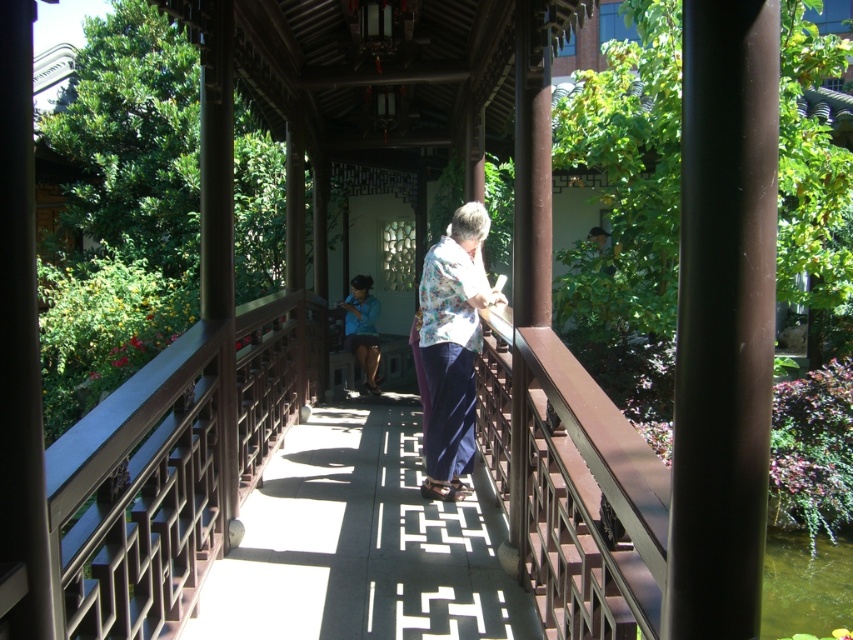
Is brown wooden bridge at center smaller than blue fabric shirt at center?

Correct, brown wooden bridge at center occupies less space than blue fabric shirt at center.

Which of these two, brown wooden bridge at center or blue fabric shirt at center, stands shorter?

Standing shorter between the two is brown wooden bridge at center.

Between point (621, 488) and point (364, 282), which one is positioned in front?

Point (621, 488) is more forward.

What are the coordinates of `brown wooden bridge at center` in the screenshot? It's located at 167,468.

Is floral fabric shirt at center positioned in front of blue fabric shirt at center?

Yes, it is in front of blue fabric shirt at center.

The height and width of the screenshot is (640, 853). In order to click on floral fabric shirt at center in this screenshot , I will do `click(451, 348)`.

Can you confirm if brown wooden bridge at center is positioned to the left of floral fabric shirt at center?

Incorrect, brown wooden bridge at center is not on the left side of floral fabric shirt at center.

Between point (57, 438) and point (467, 429), which one is positioned behind?

Positioned behind is point (467, 429).

Locate an element on the screen. Image resolution: width=853 pixels, height=640 pixels. brown wooden bridge at center is located at coordinates (167, 468).